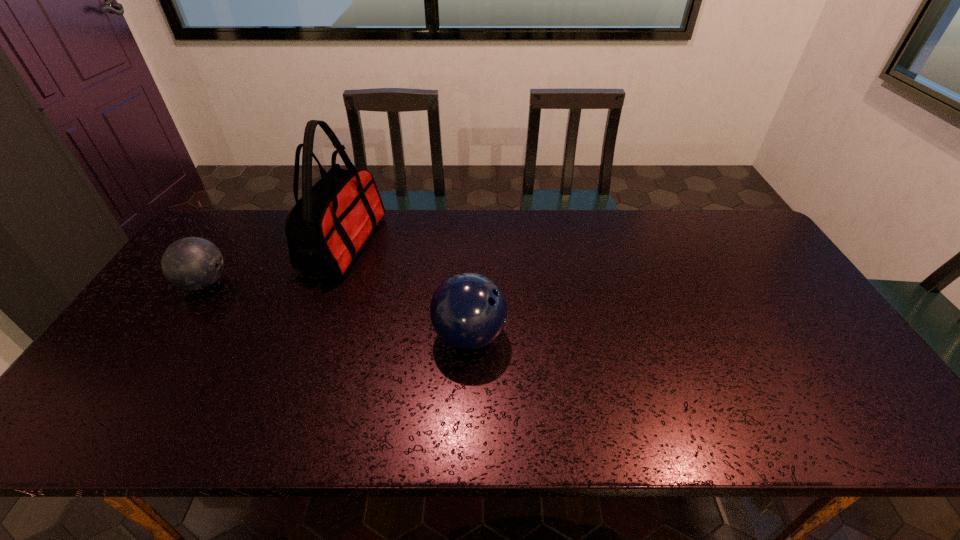
You are a GUI agent. You are given a task and a screenshot of the screen. Output one action in this format:
    pyautogui.click(x=<x>, y=<y>)
    Task: Click on the empty location between the duffel bag and the nearest object
    Image resolution: width=960 pixels, height=540 pixels.
    Given the screenshot: What is the action you would take?
    pyautogui.click(x=406, y=289)

This screenshot has height=540, width=960. What are the coordinates of `vacant space in between the second object from right to left and the left bowling ball` in the screenshot? It's located at (275, 263).

Identify the location of free space between the tallest object and the taller bowling ball. (406, 289).

At what (x,y) coordinates should I click in order to perform the action: click on unoccupied position between the shorter bowling ball and the taller bowling ball. Please return your answer as a coordinate pair (x, y). The image size is (960, 540). Looking at the image, I should click on (337, 309).

Where is `free point between the rightmost object and the leftmost object`? free point between the rightmost object and the leftmost object is located at coordinates (337, 309).

Find the location of a particular element. unoccupied area between the second tallest object and the tallest object is located at coordinates (406, 289).

Locate an element on the screen. The width and height of the screenshot is (960, 540). unoccupied area between the shorter bowling ball and the duffel bag is located at coordinates (275, 263).

Select which object is the second closest to the second object from right to left. Please provide its 2D coordinates. Your answer should be formatted as a tuple, i.e. [(x, y)], where the tuple contains the x and y coordinates of a point satisfying the conditions above.

[(468, 311)]

Identify the location of object that ranks as the closest to the nearest object. (325, 229).